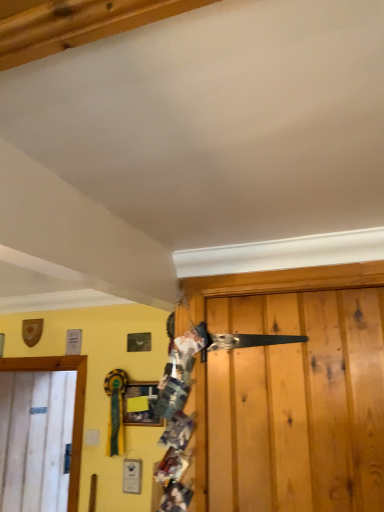
Question: From the image's perspective, is white wood door at left located above or below matte wooden picture frame at center?

Choices:
 (A) below
 (B) above

Answer: (A)

Question: From a real-world perspective, is white wood door at left physically located above or below matte wooden picture frame at center?

Choices:
 (A) below
 (B) above

Answer: (A)

Question: Which of these objects is positioned closest to the white wood door at left?

Choices:
 (A) multicolored fabric at center
 (B) matte wooden picture frame at center

Answer: (B)

Question: Considering the real-world distances, which object is farthest from the white wood door at left?

Choices:
 (A) matte wooden picture frame at center
 (B) multicolored fabric at center

Answer: (B)